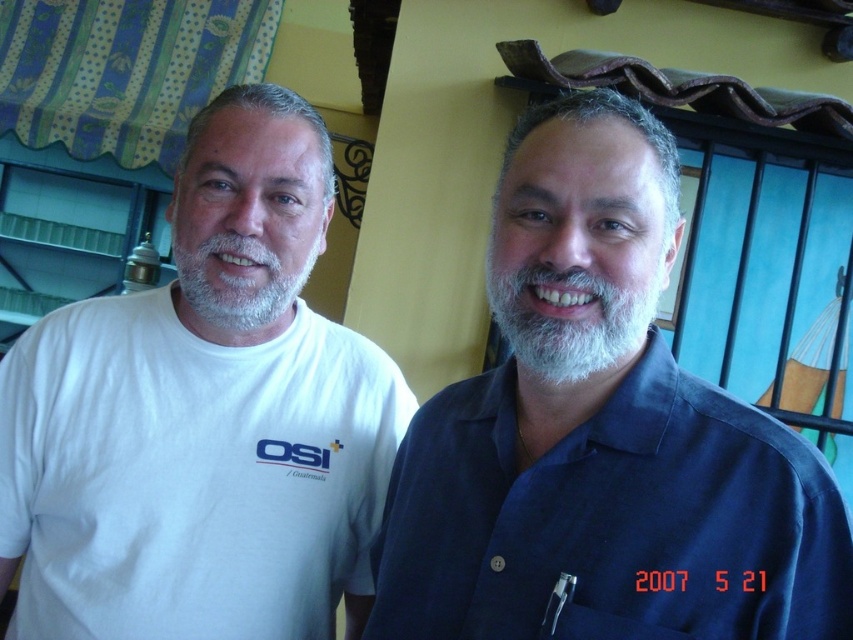
Question: Can you confirm if blue smooth shirt at center is thinner than white cotton t-shirt at left?

Choices:
 (A) yes
 (B) no

Answer: (A)

Question: Does gray/soft hair at center have a lesser width compared to grayhairbeard at left?

Choices:
 (A) yes
 (B) no

Answer: (A)

Question: Among these objects, which one is nearest to the camera?

Choices:
 (A) gray/soft hair at center
 (B) grayhairbeard at left

Answer: (A)

Question: Estimate the real-world distances between objects in this image. Which object is farther from the grayhairbeard at left?

Choices:
 (A) white cotton t-shirt at left
 (B) gray/soft hair at center

Answer: (B)

Question: Can you confirm if white cotton t-shirt at left is positioned to the left of gray/soft hair at center?

Choices:
 (A) no
 (B) yes

Answer: (B)

Question: Which object appears farthest from the camera in this image?

Choices:
 (A) grayhairbeard at left
 (B) blue smooth shirt at center
 (C) white cotton t-shirt at left
 (D) gray/soft hair at center

Answer: (A)